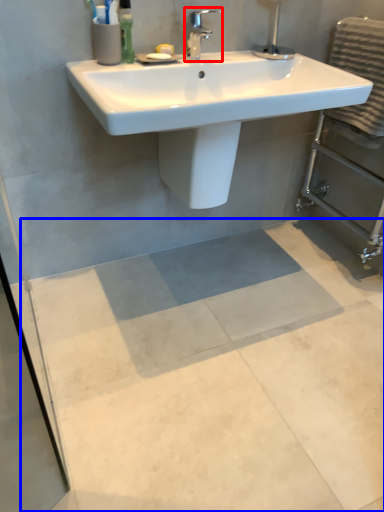
Question: Among these objects, which one is farthest to the camera, tap (highlighted by a red box) or concrete (highlighted by a blue box)?

Choices:
 (A) tap
 (B) concrete

Answer: (A)